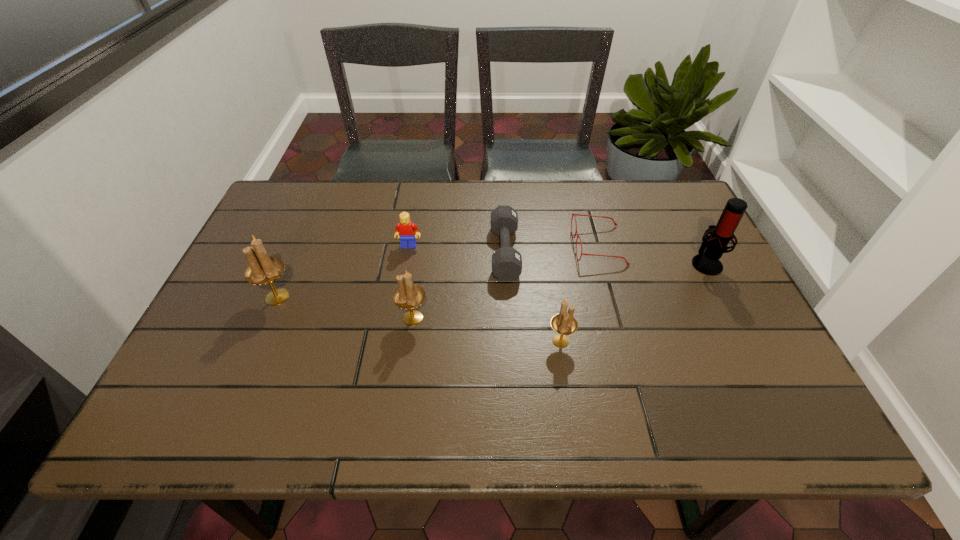
Identify the location of object that is the sixth closest to the shortest candle holder. (262, 269).

At what (x,y) coordinates should I click in order to perform the action: click on candle holder that can be found as the third closest to the dumbbell. Please return your answer as a coordinate pair (x, y). The height and width of the screenshot is (540, 960). Looking at the image, I should click on (262, 269).

Where is `candle holder that can be found as the second closest to the second candle holder from right to left`? The width and height of the screenshot is (960, 540). candle holder that can be found as the second closest to the second candle holder from right to left is located at coordinates (564, 323).

Find the location of a particular element. The width and height of the screenshot is (960, 540). blank space that satisfies the following two spatial constraints: 1. on the face of the rightmost object; 2. on the right side of the shortest object is located at coordinates (603, 263).

Find the location of a particular element. The height and width of the screenshot is (540, 960). free space that satisfies the following two spatial constraints: 1. on the back side of the microphone; 2. on the right side of the tallest candle holder is located at coordinates (292, 263).

The width and height of the screenshot is (960, 540). Find the location of `free region that satisfies the following two spatial constraints: 1. on the face of the third shortest object; 2. on the right side of the fourth object from left to right`. free region that satisfies the following two spatial constraints: 1. on the face of the third shortest object; 2. on the right side of the fourth object from left to right is located at coordinates (408, 252).

Locate an element on the screen. free space that satisfies the following two spatial constraints: 1. on the face of the sixth tallest object; 2. on the left side of the Lego is located at coordinates click(x=408, y=252).

Find the location of a particular element. vacant space that satisfies the following two spatial constraints: 1. on the face of the second object from right to left; 2. on the left side of the rightmost object is located at coordinates (603, 263).